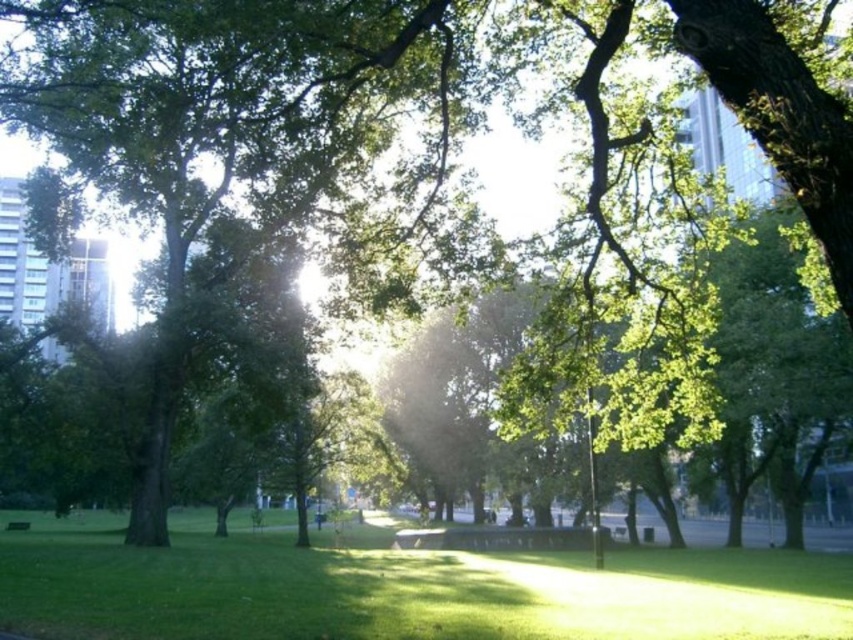
Can you confirm if green grassy at center is positioned above green wooden bench at center?

Yes, green grassy at center is above green wooden bench at center.

Does point (248, 621) come closer to viewer compared to point (16, 520)?

Yes, point (248, 621) is closer to viewer.

Measure the distance between green grassy at center and camera.

green grassy at center and camera are 28.87 feet apart from each other.

You are a GUI agent. You are given a task and a screenshot of the screen. Output one action in this format:
    pyautogui.click(x=<x>, y=<y>)
    Task: Click on the green grassy at center
    This screenshot has width=853, height=640.
    Given the screenshot: What is the action you would take?
    pyautogui.click(x=397, y=588)